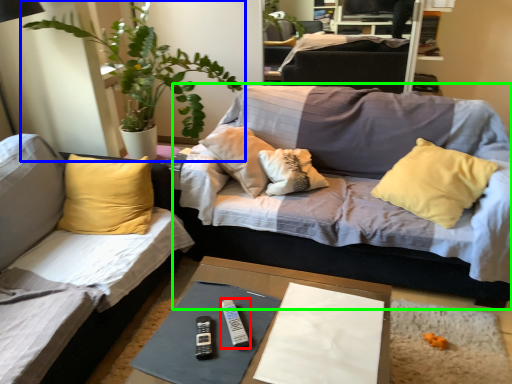
Question: Which object is positioned closest to remote (highlighted by a red box)? Select from houseplant (highlighted by a blue box) and studio couch (highlighted by a green box).

Choices:
 (A) houseplant
 (B) studio couch

Answer: (B)